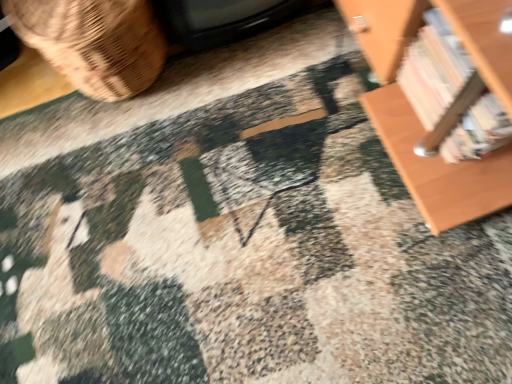
Question: Should I look upward or downward to see brown woven basket at left?

Choices:
 (A) down
 (B) up

Answer: (B)

Question: Does wooden bookshelf at upper right have a greater height compared to brown woven basket at left?

Choices:
 (A) no
 (B) yes

Answer: (A)

Question: Is wooden bookshelf at upper right positioned beyond the bounds of brown woven basket at left?

Choices:
 (A) no
 (B) yes

Answer: (B)

Question: Is wooden bookshelf at upper right at the right side of brown woven basket at left?

Choices:
 (A) yes
 (B) no

Answer: (A)

Question: Is wooden bookshelf at upper right bigger than brown woven basket at left?

Choices:
 (A) no
 (B) yes

Answer: (A)

Question: Can brown woven basket at left be found inside wooden bookshelf at upper right?

Choices:
 (A) no
 (B) yes

Answer: (A)

Question: Is wooden bookshelf at upper right smaller than brown woven basket at left?

Choices:
 (A) no
 (B) yes

Answer: (B)

Question: Could you tell me if brown woven basket at left is facing wooden bookshelf at upper right?

Choices:
 (A) yes
 (B) no

Answer: (B)

Question: Does brown woven basket at left have a greater width compared to wooden bookshelf at upper right?

Choices:
 (A) yes
 (B) no

Answer: (A)

Question: Can we say brown woven basket at left lies outside wooden bookshelf at upper right?

Choices:
 (A) no
 (B) yes

Answer: (B)

Question: Is brown woven basket at left shorter than wooden bookshelf at upper right?

Choices:
 (A) no
 (B) yes

Answer: (A)

Question: Can you confirm if brown woven basket at left is bigger than wooden bookshelf at upper right?

Choices:
 (A) yes
 (B) no

Answer: (A)

Question: Is brown woven basket at left to the left of wooden bookshelf at upper right from the viewer's perspective?

Choices:
 (A) yes
 (B) no

Answer: (A)

Question: From the image's perspective, is brown woven basket at left above or below wooden bookshelf at upper right?

Choices:
 (A) below
 (B) above

Answer: (B)